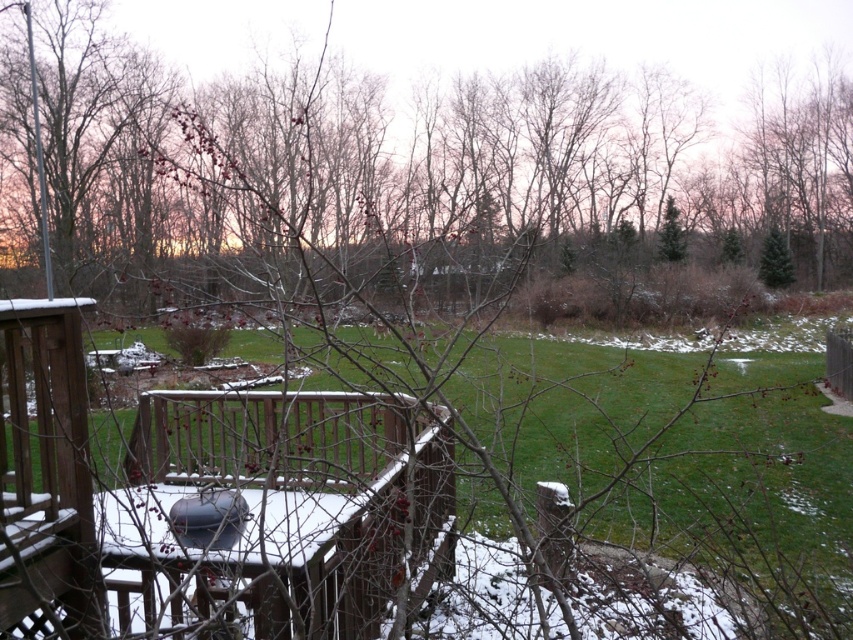
You are standing on the wooden deck at lower left and want to step onto the green grass at center. Which direction should you move to reach the grass?

The green grass at center is taller than the wooden deck at lower left, so you should move upward from the wooden deck at lower left to reach the green grass at center since it is elevated higher.